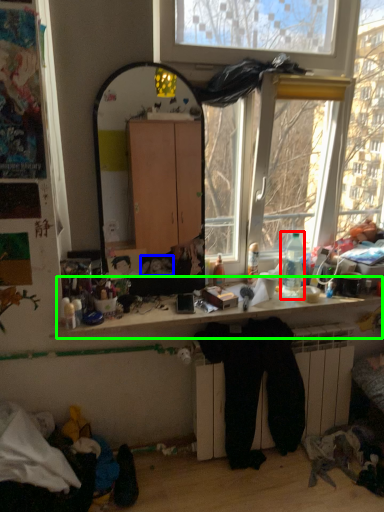
Question: Which is farther away from bottle (highlighted by a red box)? person (highlighted by a blue box) or computer desk (highlighted by a green box)?

Choices:
 (A) person
 (B) computer desk

Answer: (A)